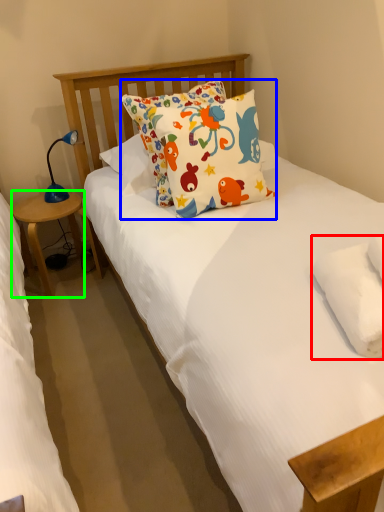
Question: Which object is positioned farthest from pillow (highlighted by a red box)? Select from pillow (highlighted by a blue box) and table (highlighted by a green box).

Choices:
 (A) pillow
 (B) table

Answer: (B)